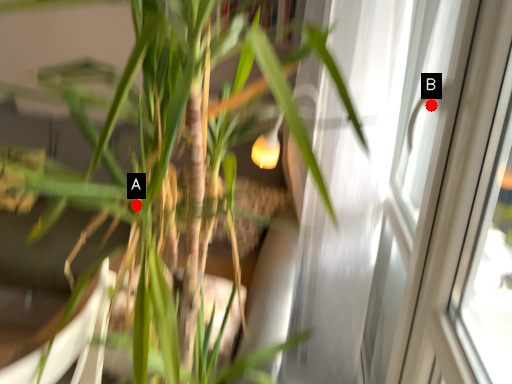
Question: Two points are circled on the image, labeled by A and B beside each circle. Which point is further to the camera?

Choices:
 (A) A is further
 (B) B is further

Answer: (B)